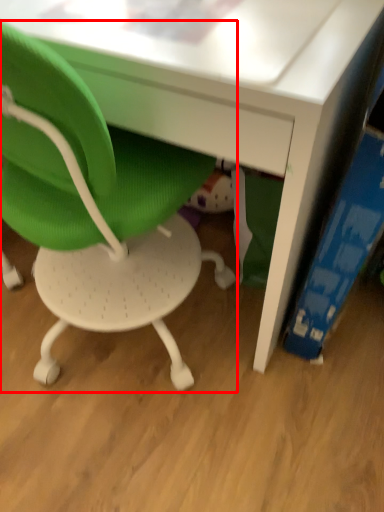
Question: From the image's perspective, where is chair (annotated by the red box) located in relation to paperback book in the image?

Choices:
 (A) above
 (B) below

Answer: (A)